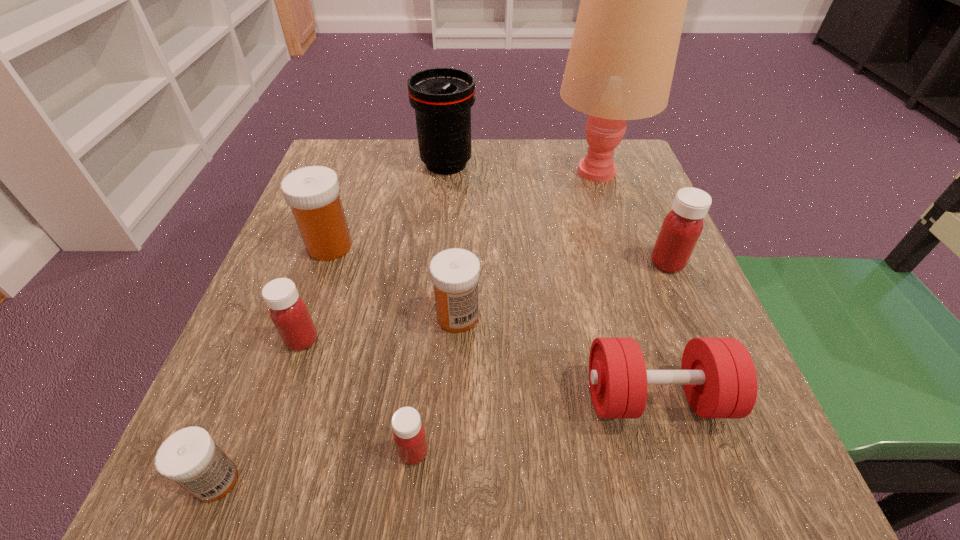
Where is `the tallest object`? This screenshot has height=540, width=960. the tallest object is located at coordinates (620, 66).

Image resolution: width=960 pixels, height=540 pixels. In order to click on pink lampshade in this screenshot , I will do `click(620, 66)`.

What are the coordinates of `the eighth shortest object` in the screenshot? It's located at pyautogui.click(x=442, y=98).

The height and width of the screenshot is (540, 960). I want to click on black telephoto lens, so click(442, 98).

You are a GUI agent. You are given a task and a screenshot of the screen. Output one action in this format:
    pyautogui.click(x=<x>, y=<y>)
    Task: Click on the biggest white medicine
    The height and width of the screenshot is (540, 960).
    Given the screenshot: What is the action you would take?
    pyautogui.click(x=313, y=192)

I want to click on the biggest red medicine, so click(x=681, y=228).

Where is `the rightmost medicine`? This screenshot has height=540, width=960. the rightmost medicine is located at coordinates (681, 228).

Where is `the rightmost white medicine`? The image size is (960, 540). the rightmost white medicine is located at coordinates (455, 273).

Find the location of a particular element. The image size is (960, 540). the second farthest white medicine is located at coordinates (455, 273).

Identify the location of the second nearest red medicine. 288,312.